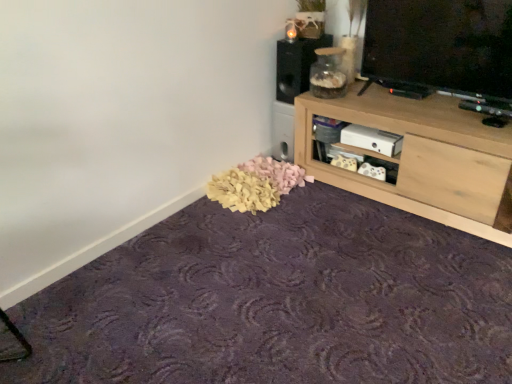
The image size is (512, 384). Identify the location of blank space situated above purple textured carpet at lower center (from a real-world perspective). (308, 279).